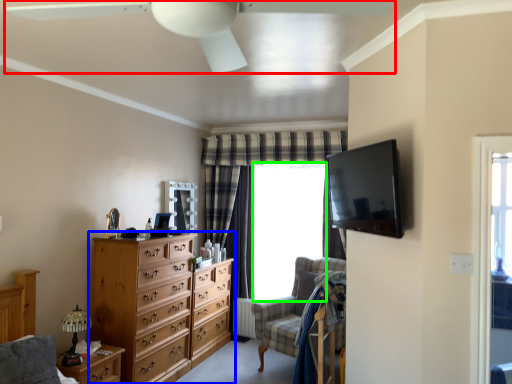
Question: Considering the real-world distances, which object is farthest from ceiling fan (highlighted by a red box)? chest of drawers (highlighted by a blue box) or window screen (highlighted by a green box)?

Choices:
 (A) chest of drawers
 (B) window screen

Answer: (B)